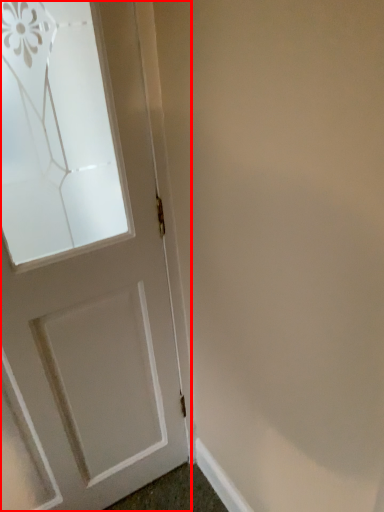
Question: From the image, what is the correct spatial relationship of door (annotated by the red box) in relation to molding?

Choices:
 (A) left
 (B) right

Answer: (A)